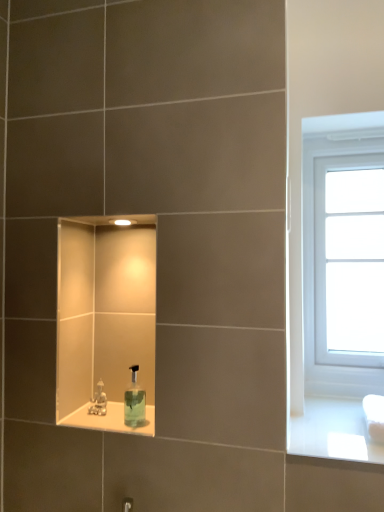
Question: Is metallic silver faucet at lower center wider or thinner than transparent plastic soap dispenser at center?

Choices:
 (A) wide
 (B) thin

Answer: (B)

Question: From their relative heights in the image, would you say metallic silver faucet at lower center is taller or shorter than transparent plastic soap dispenser at center?

Choices:
 (A) short
 (B) tall

Answer: (A)

Question: Which object is the closest to the white plastic window at right?

Choices:
 (A) clear glass soap dispenser at center
 (B) metallic silver faucet at lower center
 (C) transparent plastic soap dispenser at center

Answer: (A)

Question: Considering the real-world distances, which object is farthest from the white plastic window at right?

Choices:
 (A) metallic silver faucet at lower center
 (B) transparent plastic soap dispenser at center
 (C) clear glass soap dispenser at center

Answer: (A)